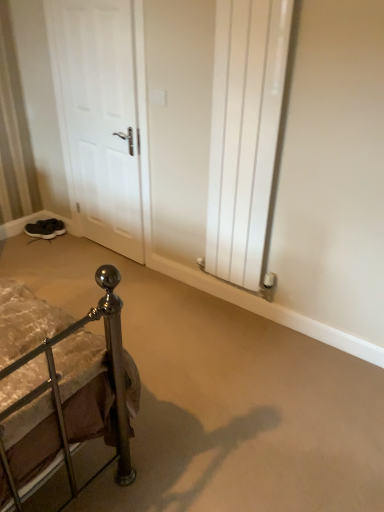
The height and width of the screenshot is (512, 384). In order to click on vacant space in front of white matte door at left in this screenshot , I will do `click(86, 275)`.